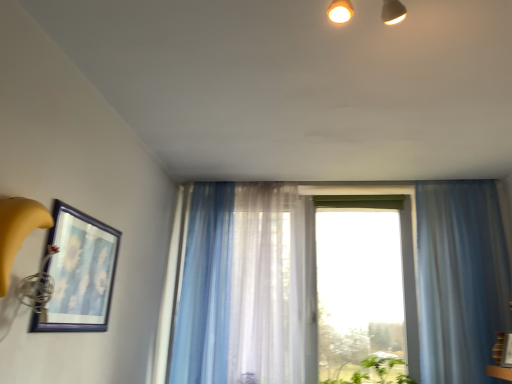
Question: From a real-world perspective, relative to translucent fabric curtain at center, which is the second curtain in left-to-right order, is matte blue picture frame at left vertically above or below?

Choices:
 (A) above
 (B) below

Answer: (B)

Question: In terms of height, does matte blue picture frame at left look taller or shorter compared to translucent fabric curtain at center, which is the second curtain in left-to-right order?

Choices:
 (A) short
 (B) tall

Answer: (A)

Question: Estimate the real-world distances between objects in this image. Which object is closer to the translucent fabric window at center?

Choices:
 (A) translucent blue curtain at center, placed as the 3th curtain when sorted from right to left
 (B) matte blue picture frame at left
 (C) translucent blue curtain at right, the third curtain from the left
 (D) translucent fabric curtain at center, placed as the second curtain when sorted from right to left

Answer: (C)

Question: Which is nearer to the translucent blue curtain at center, placed as the 3th curtain when sorted from right to left?

Choices:
 (A) translucent blue curtain at right, which is the first curtain in right-to-left order
 (B) matte blue picture frame at left
 (C) translucent fabric curtain at center, which is the second curtain in left-to-right order
 (D) translucent fabric window at center

Answer: (C)